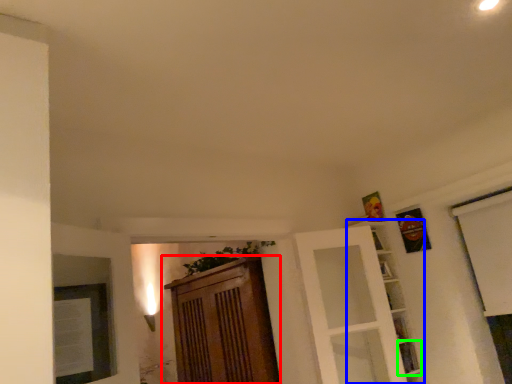
Question: Which is farther away from cabinetry (highlighted by a red box)? shelf (highlighted by a blue box) or shelf (highlighted by a green box)?

Choices:
 (A) shelf
 (B) shelf

Answer: (B)